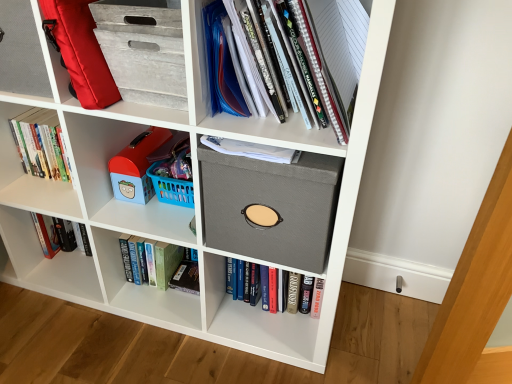
I want to click on vacant space in front of hardcover book at center, which is the 3th book from top to bottom, so click(x=267, y=369).